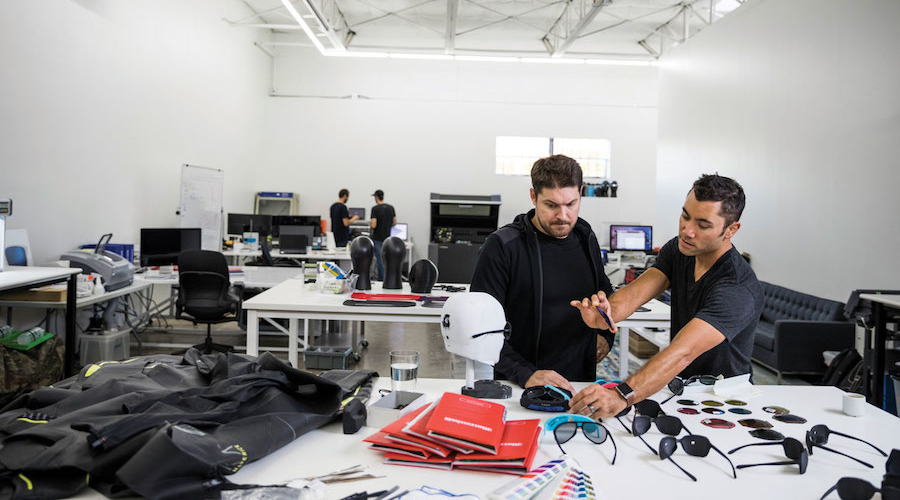
The image size is (900, 500). In order to click on chair in this screenshot , I will do `click(202, 295)`.